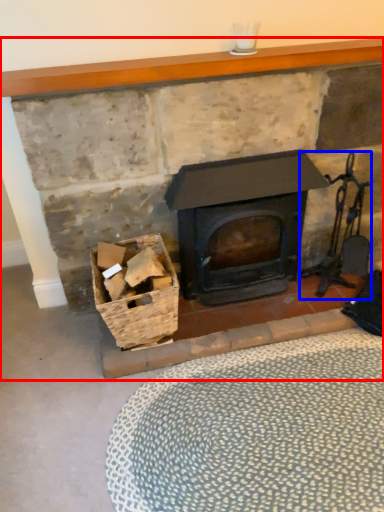
Question: Which of the following is the closest to the observer, fireplace (highlighted by a red box) or chair (highlighted by a blue box)?

Choices:
 (A) fireplace
 (B) chair

Answer: (A)